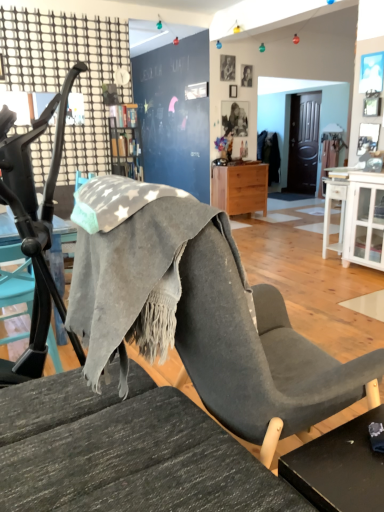
Where is `empty space that is ontop of black matte table at lower right (from a real-world perspective)`? The height and width of the screenshot is (512, 384). empty space that is ontop of black matte table at lower right (from a real-world perspective) is located at coordinates coord(355,454).